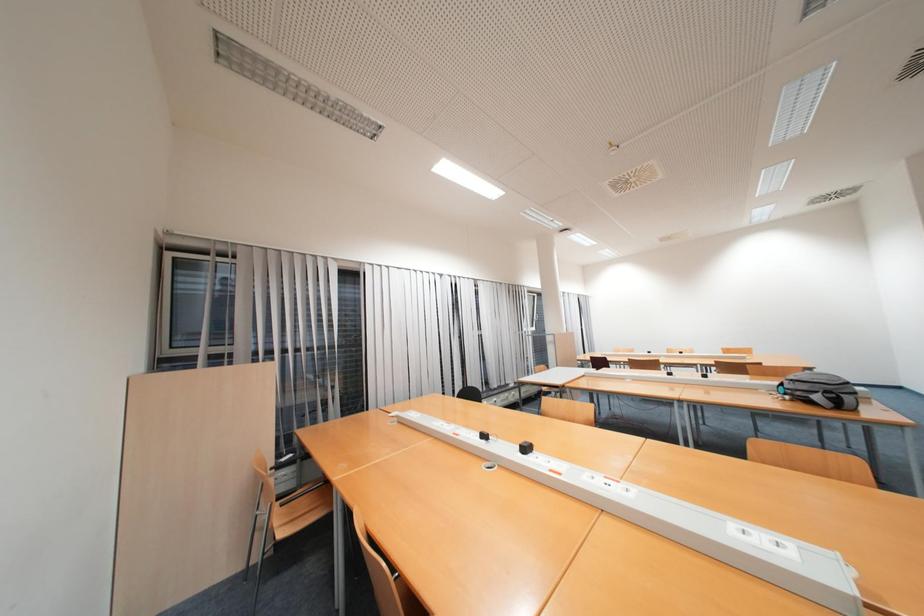
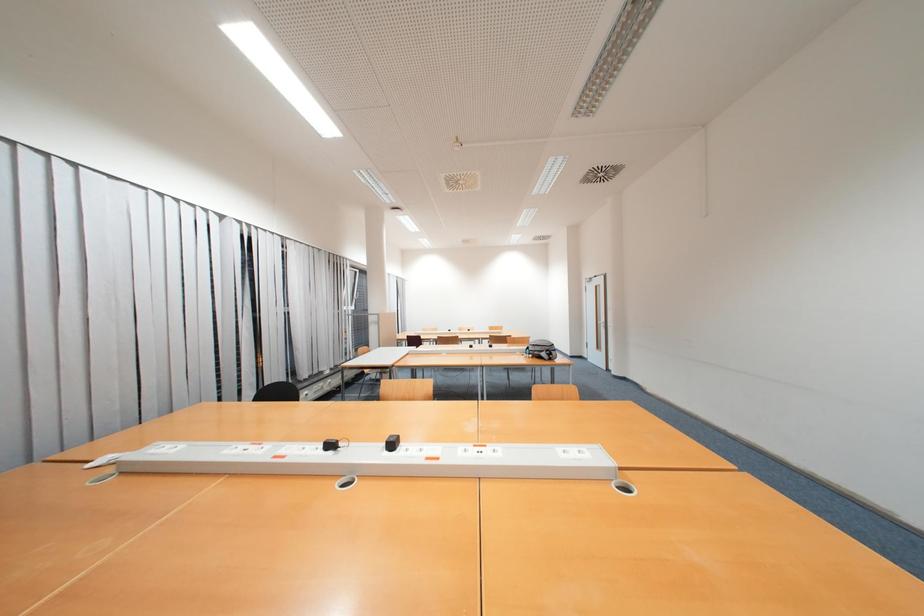
Question: The first image is from the beginning of the video and the second image is from the end. How did the camera likely rotate when shooting the video?

Choices:
 (A) Left
 (B) Right
 (C) Up
 (D) Down

Answer: (B)